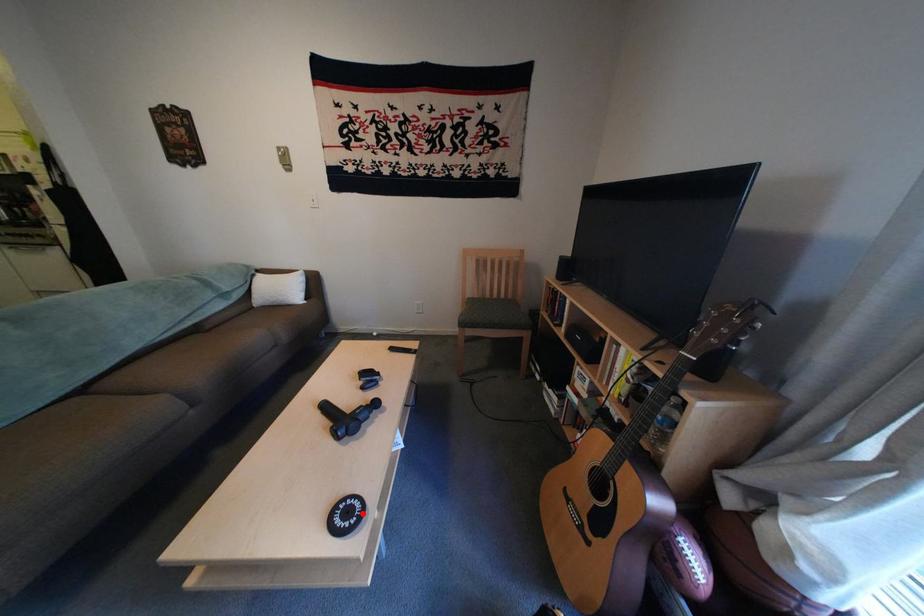
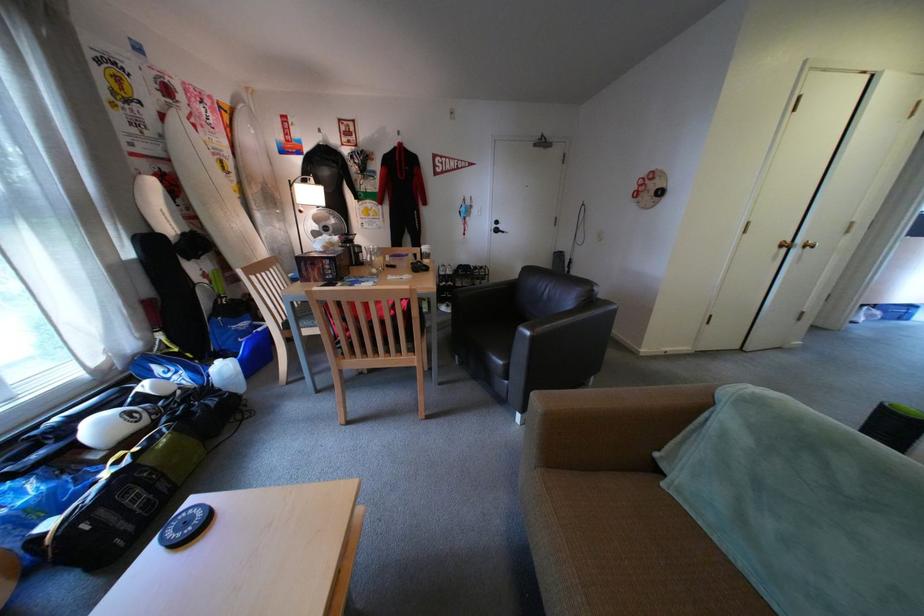
In the second image, find the point that corresponds to the highlighted location in the first image.

(199, 525)